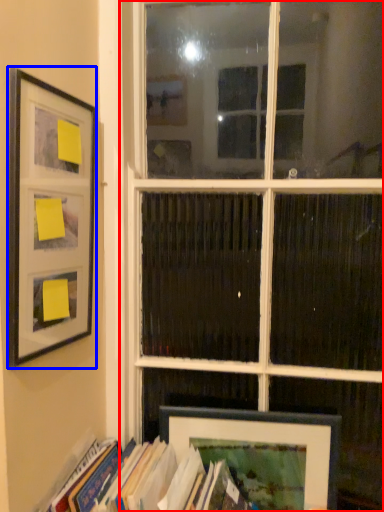
Question: Which point is further to the camera, window (highlighted by a red box) or picture frame (highlighted by a blue box)?

Choices:
 (A) window
 (B) picture frame

Answer: (A)